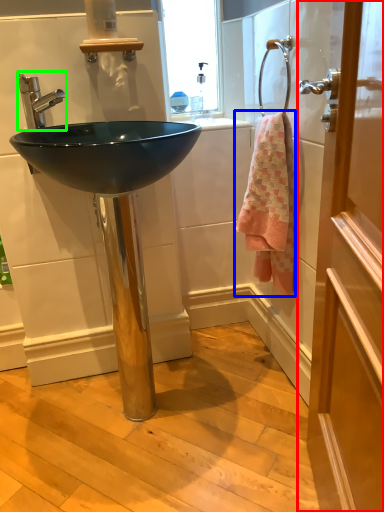
Question: Considering the real-world distances, which object is closest to door (highlighted by a red box)? towel/napkin (highlighted by a blue box) or tap (highlighted by a green box).

Choices:
 (A) towel/napkin
 (B) tap

Answer: (A)